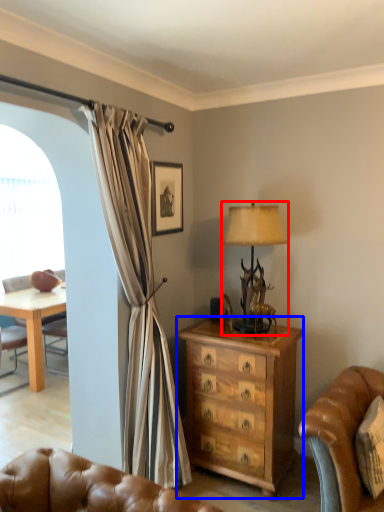
Question: Which object appears closest to the camera in this image, lamp (highlighted by a red box) or chest of drawers (highlighted by a blue box)?

Choices:
 (A) lamp
 (B) chest of drawers

Answer: (B)